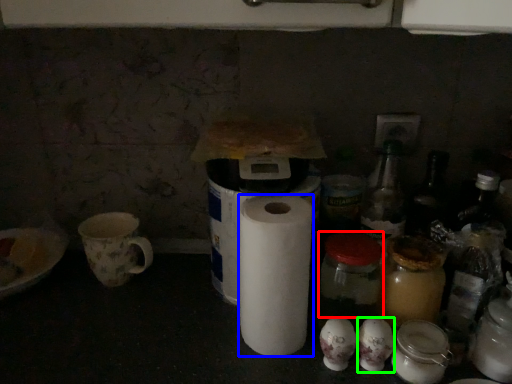
Question: Estimate the real-world distances between objects in this image. Which object is closer to glass jar (highlighted by a red box), paper towel (highlighted by a blue box) or toilet paper (highlighted by a green box)?

Choices:
 (A) paper towel
 (B) toilet paper

Answer: (B)